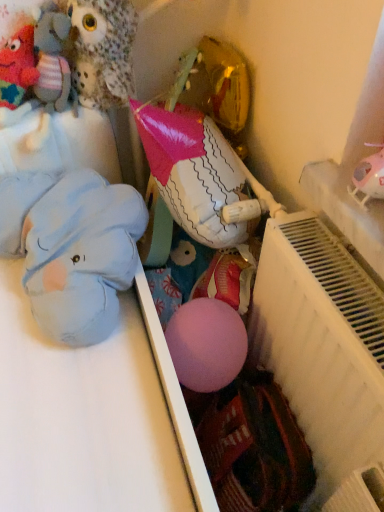
Question: Is blue plush elephant at left, arranged as the 1th toy when ordered from the bottom, aimed at white matte radiator at right?

Choices:
 (A) yes
 (B) no

Answer: (B)

Question: From a real-world perspective, is blue plush elephant at left, which is counted as the 4th toy, starting from the top, over white matte radiator at right?

Choices:
 (A) no
 (B) yes

Answer: (B)

Question: Is blue plush elephant at left, arranged as the 1th toy when ordered from the bottom, positioned with its back to white matte radiator at right?

Choices:
 (A) yes
 (B) no

Answer: (B)

Question: Can you confirm if blue plush elephant at left, which is counted as the 4th toy, starting from the top, is smaller than white matte radiator at right?

Choices:
 (A) yes
 (B) no

Answer: (A)

Question: Can you confirm if blue plush elephant at left, which is counted as the 4th toy, starting from the top, is positioned to the right of white matte radiator at right?

Choices:
 (A) no
 (B) yes

Answer: (A)

Question: In the image, is blue plush elephant at left, which is counted as the 4th toy, starting from the top, on the left side or the right side of knitted wool toy at upper left, acting as the 2th toy starting from the top?

Choices:
 (A) left
 (B) right

Answer: (B)

Question: Would you say blue plush elephant at left, arranged as the 1th toy when ordered from the bottom, is inside or outside knitted wool toy at upper left, acting as the 2th toy starting from the top?

Choices:
 (A) outside
 (B) inside

Answer: (A)

Question: Considering the positions of blue plush elephant at left, arranged as the 1th toy when ordered from the bottom, and knitted wool toy at upper left, which appears as the third toy when ordered from the bottom, in the image, is blue plush elephant at left, arranged as the 1th toy when ordered from the bottom, bigger or smaller than knitted wool toy at upper left, which appears as the third toy when ordered from the bottom,?

Choices:
 (A) small
 (B) big

Answer: (B)

Question: Looking at their shapes, would you say blue plush elephant at left, which is counted as the 4th toy, starting from the top, is wider or thinner than knitted wool toy at upper left, acting as the 2th toy starting from the top?

Choices:
 (A) wide
 (B) thin

Answer: (A)

Question: From their relative heights in the image, would you say fluffy fabric owl at upper left, placed as the 1th toy when sorted from top to bottom, is taller or shorter than knitted wool toy at upper left, which appears as the third toy when ordered from the bottom?

Choices:
 (A) tall
 (B) short

Answer: (A)

Question: In the image, is fluffy fabric owl at upper left, the 4th toy ordered from the bottom, positioned in front of or behind knitted wool toy at upper left, acting as the 2th toy starting from the top?

Choices:
 (A) behind
 (B) front

Answer: (B)

Question: From a real-world perspective, is fluffy fabric owl at upper left, the 4th toy ordered from the bottom, above or below knitted wool toy at upper left, acting as the 2th toy starting from the top?

Choices:
 (A) above
 (B) below

Answer: (A)

Question: Considering the positions of point (114, 84) and point (21, 82), is point (114, 84) closer or farther from the camera than point (21, 82)?

Choices:
 (A) farther
 (B) closer

Answer: (A)

Question: In terms of size, does white matte radiator at right appear bigger or smaller than blue plush elephant at left, arranged as the 1th toy when ordered from the bottom?

Choices:
 (A) big
 (B) small

Answer: (A)

Question: In the image, is white matte radiator at right positioned in front of or behind blue plush elephant at left, which is counted as the 4th toy, starting from the top?

Choices:
 (A) behind
 (B) front

Answer: (B)